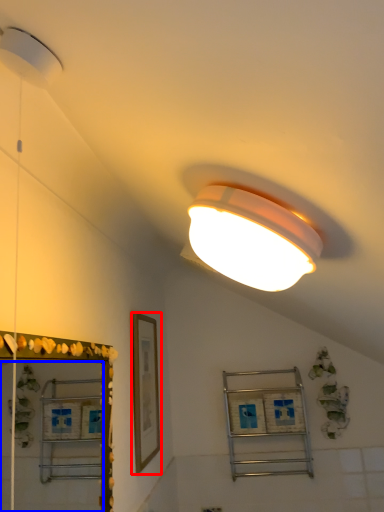
Question: Which of the following is the farthest to the observer, picture frame (highlighted by a red box) or mirror (highlighted by a blue box)?

Choices:
 (A) picture frame
 (B) mirror

Answer: (A)